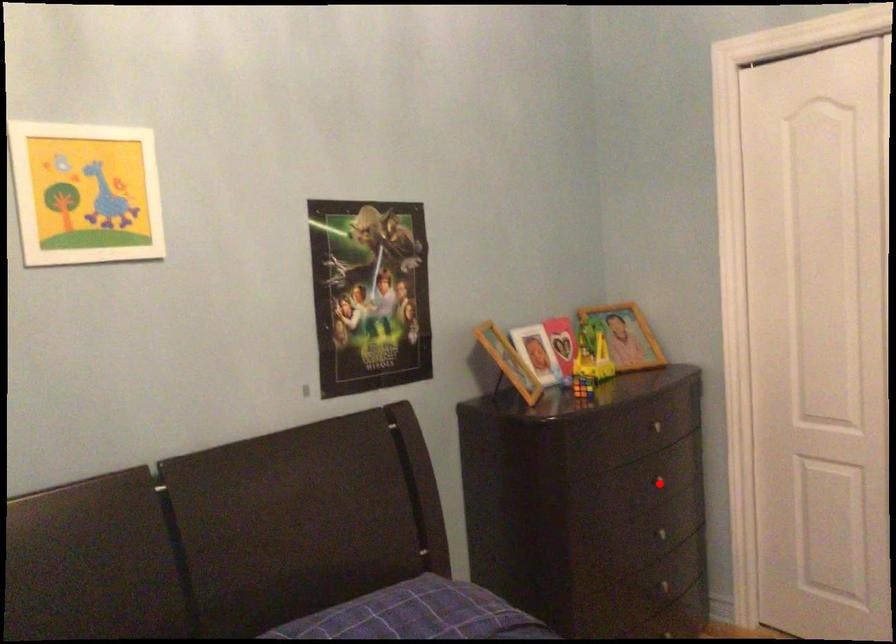
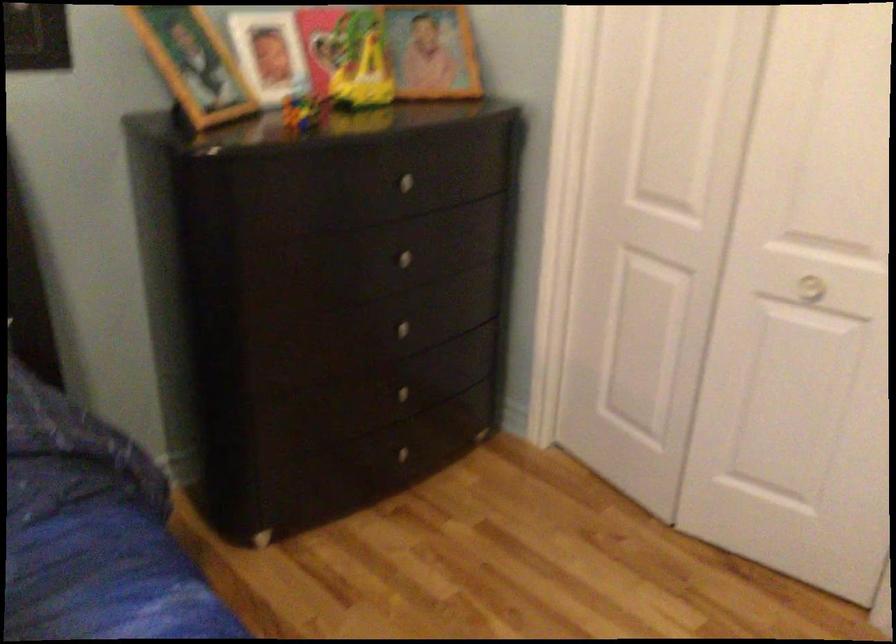
Question: A red point is marked in image1. In image2, is the corresponding 3D point closer to the camera or farther? Reply with the corresponding letter.

Choices:
 (A) The corresponding 3D point is closer.
 (B) The corresponding 3D point is farther.

Answer: (A)